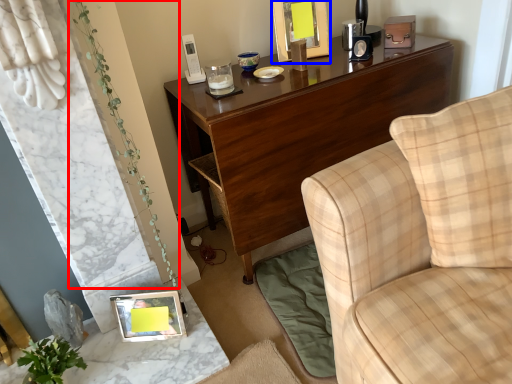
Question: Among these objects, which one is farthest to the camera, plant (highlighted by a red box) or picture frame (highlighted by a blue box)?

Choices:
 (A) plant
 (B) picture frame

Answer: (B)